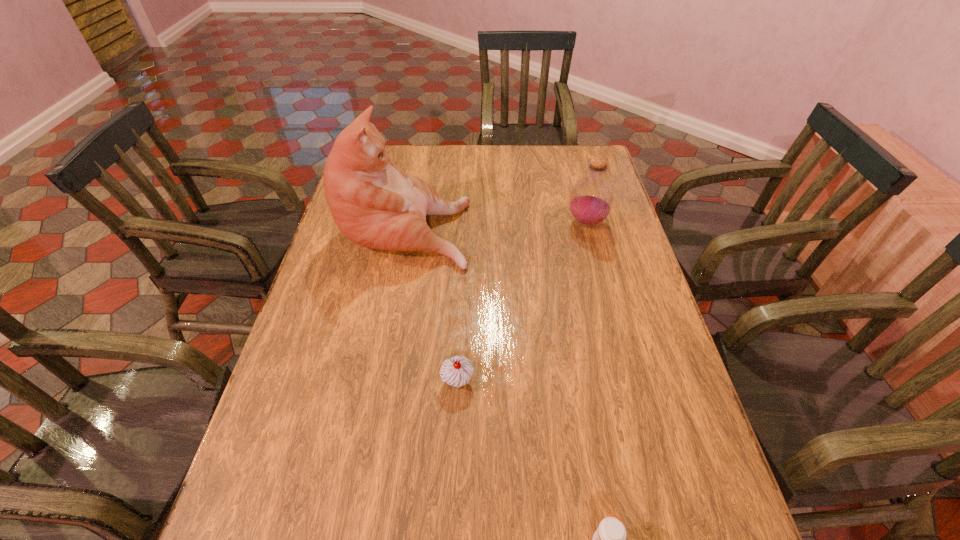
The height and width of the screenshot is (540, 960). I want to click on vacant space at the far edge of the desktop, so click(x=435, y=153).

At what (x,y) coordinates should I click in order to perform the action: click on vacant position at the left edge of the desktop. Please return your answer as a coordinate pair (x, y). The width and height of the screenshot is (960, 540). Looking at the image, I should click on (322, 283).

At what (x,y) coordinates should I click in order to perform the action: click on blank space at the right edge of the desktop. Please return your answer as a coordinate pair (x, y). The height and width of the screenshot is (540, 960). Looking at the image, I should click on (588, 240).

Where is `vacant space at the far left corner of the desktop`? The image size is (960, 540). vacant space at the far left corner of the desktop is located at coordinates (395, 163).

In order to click on vacant space that is in between the cat and the bottle in this screenshot , I will do `click(495, 225)`.

Identify the location of vacant space that's between the second tallest object and the cupcake. This screenshot has width=960, height=540. (522, 302).

Where is `empty space that is in between the cat and the second shortest object`? The image size is (960, 540). empty space that is in between the cat and the second shortest object is located at coordinates (432, 303).

Where is `vacant area that lies between the second shortest object and the cat`? This screenshot has height=540, width=960. vacant area that lies between the second shortest object and the cat is located at coordinates click(x=432, y=303).

Identify which object is the third closest to the medicine. Please provide its 2D coordinates. Your answer should be formatted as a tuple, i.e. [(x, y)], where the tuple contains the x and y coordinates of a point satisfying the conditions above.

[(591, 199)]

The width and height of the screenshot is (960, 540). Identify the location of object that is the second closest one to the third shortest object. (457, 371).